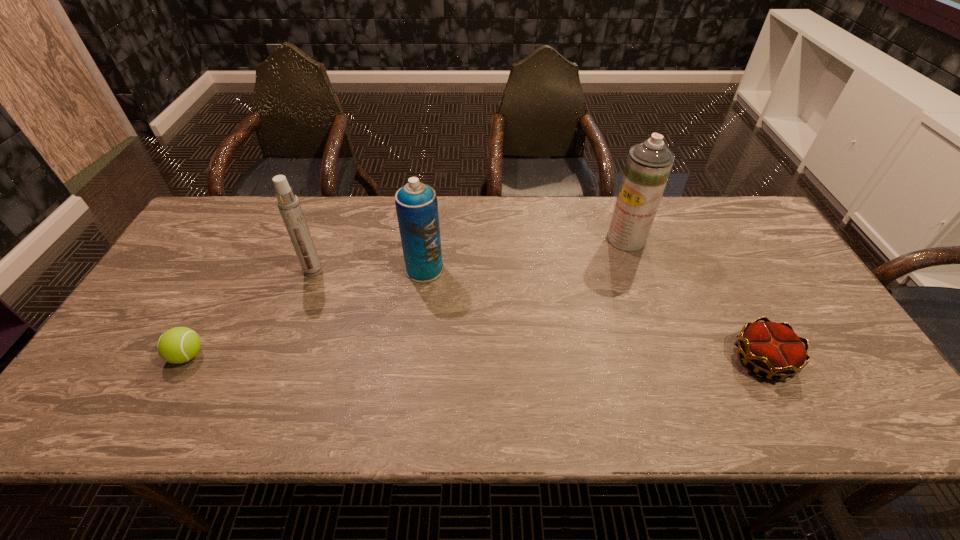
Find the location of a particular element. the farthest object is located at coordinates (648, 166).

You are a GUI agent. You are given a task and a screenshot of the screen. Output one action in this format:
    pyautogui.click(x=<x>, y=<y>)
    Task: Click on the rightmost aerosol can
    
    Given the screenshot: What is the action you would take?
    pyautogui.click(x=648, y=166)

You are a GUI agent. You are given a task and a screenshot of the screen. Output one action in this format:
    pyautogui.click(x=<x>, y=<y>)
    Task: Click on the second object from left to right
    This screenshot has height=540, width=960.
    Given the screenshot: What is the action you would take?
    pyautogui.click(x=288, y=203)

I want to click on the second aerosol can from left to right, so click(x=416, y=204).

Where is `tennis ball`? The width and height of the screenshot is (960, 540). tennis ball is located at coordinates (177, 345).

I want to click on crown, so click(773, 348).

Locate an element on the screen. This screenshot has width=960, height=540. vacant space located 0.100m on the right of the farthest aerosol can is located at coordinates (678, 239).

Identify the location of free space located 0.180m on the back of the leftmost aerosol can. The width and height of the screenshot is (960, 540). (330, 225).

Find the location of a particular element. This screenshot has width=960, height=540. vacant position located on the left of the second aerosol can from right to left is located at coordinates coord(328,269).

Locate an element on the screen. This screenshot has width=960, height=540. vacant space positioned 0.110m on the right of the tennis ball is located at coordinates (252, 355).